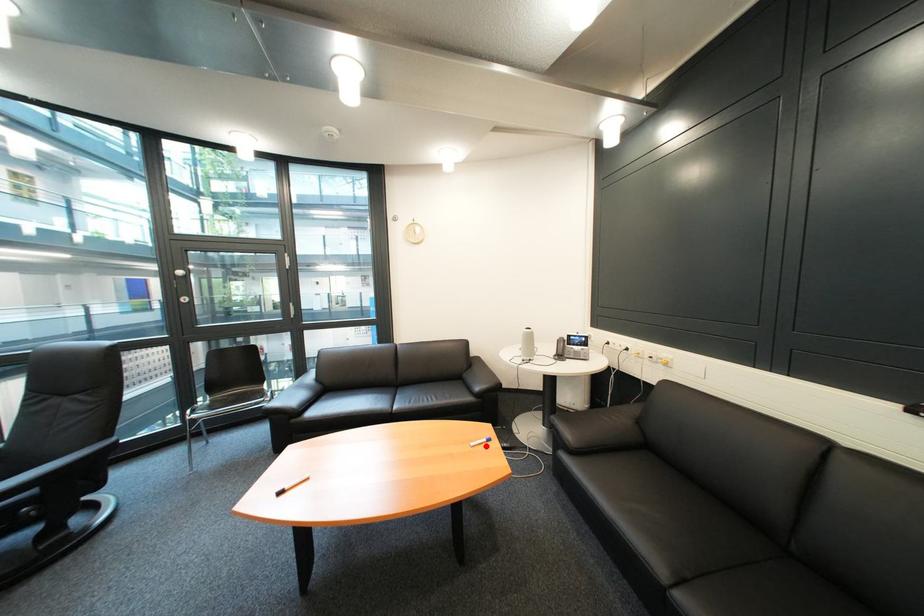
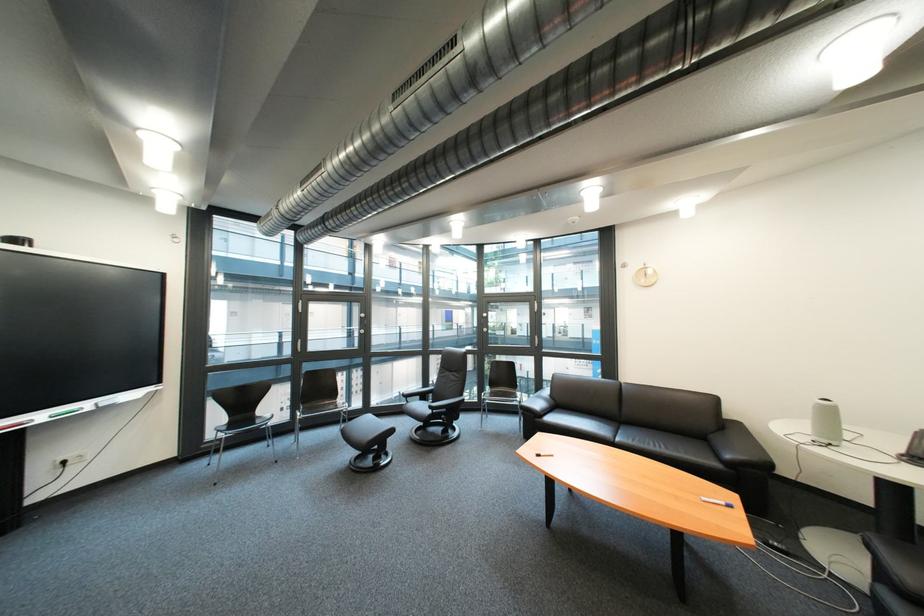
Find the pixel in the second image that matches the highlighted location in the first image.

(718, 501)